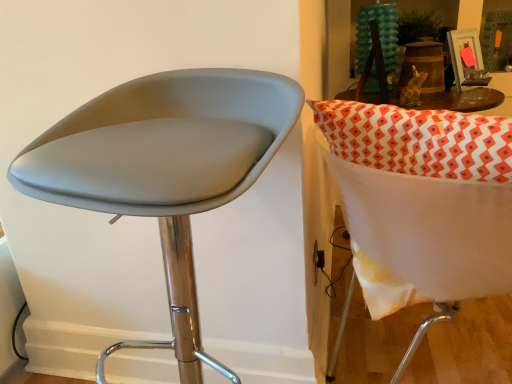
Question: In terms of width, does matte gray stool at left, placed as the second chair when sorted from right to left, look wider or thinner when compared to white fabric chair at right, placed as the 2th chair when sorted from left to right?

Choices:
 (A) thin
 (B) wide

Answer: (A)

Question: From the image's perspective, is matte gray stool at left, which is the 1th chair in left-to-right order, located above or below white fabric chair at right, which appears as the first chair when viewed from the right?

Choices:
 (A) above
 (B) below

Answer: (B)

Question: In the image, is matte gray stool at left, placed as the second chair when sorted from right to left, positioned in front of or behind white fabric chair at right, which appears as the first chair when viewed from the right?

Choices:
 (A) behind
 (B) front

Answer: (B)

Question: Is white fabric chair at right, placed as the 2th chair when sorted from left to right, situated inside matte gray stool at left, placed as the second chair when sorted from right to left, or outside?

Choices:
 (A) inside
 (B) outside

Answer: (B)

Question: Relative to matte gray stool at left, which is the 1th chair in left-to-right order, is white fabric chair at right, which appears as the first chair when viewed from the right, in front or behind?

Choices:
 (A) front
 (B) behind

Answer: (B)

Question: Does point (374, 230) appear closer or farther from the camera than point (113, 162)?

Choices:
 (A) closer
 (B) farther

Answer: (B)

Question: Is white fabric chair at right, placed as the 2th chair when sorted from left to right, taller or shorter than matte gray stool at left, placed as the second chair when sorted from right to left?

Choices:
 (A) short
 (B) tall

Answer: (A)